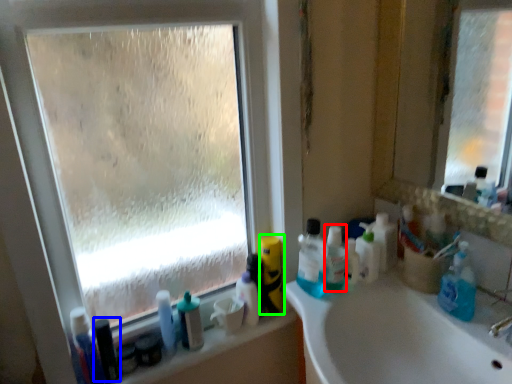
Question: Which object is positioned closest to toiletry (highlighted by a red box)? Select from toiletry (highlighted by a blue box) and cleaning product (highlighted by a green box).

Choices:
 (A) toiletry
 (B) cleaning product

Answer: (B)